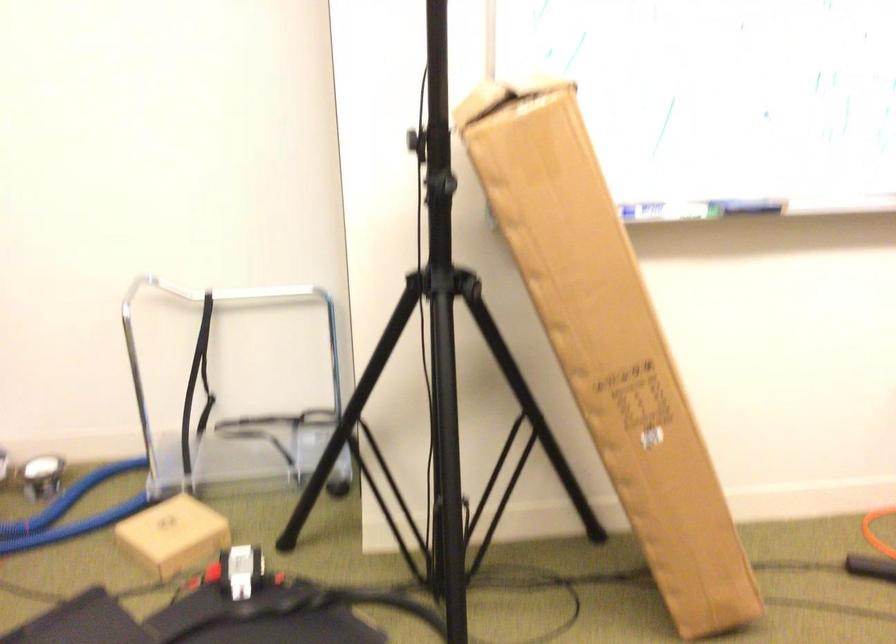
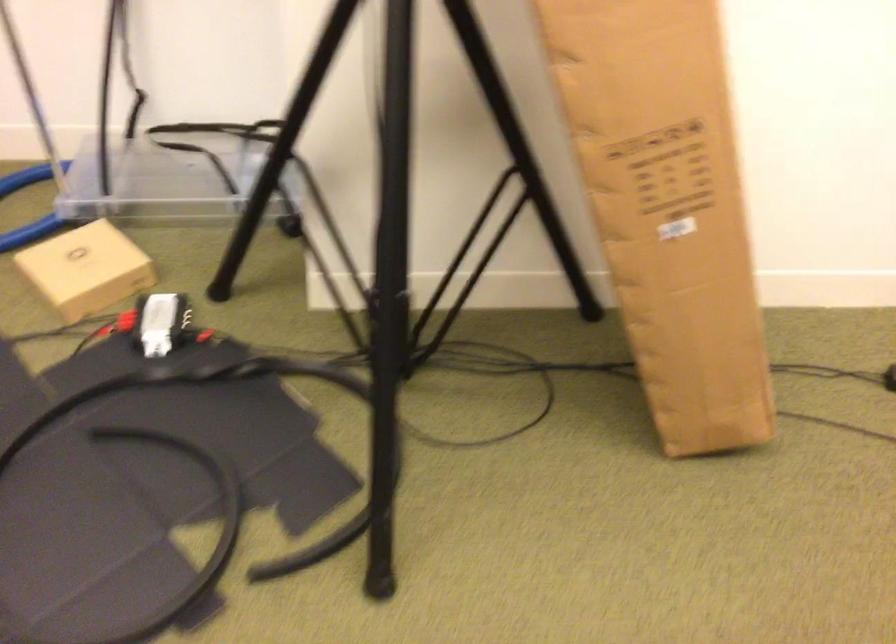
Question: The first image is from the beginning of the video and the second image is from the end. How did the camera likely rotate when shooting the video?

Choices:
 (A) Left
 (B) Right
 (C) Up
 (D) Down

Answer: (D)